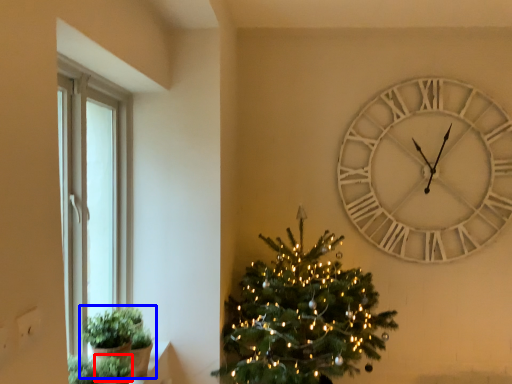
Question: Among these objects, which one is farthest to the camera, plant (highlighted by a red box) or houseplant (highlighted by a blue box)?

Choices:
 (A) plant
 (B) houseplant

Answer: (B)